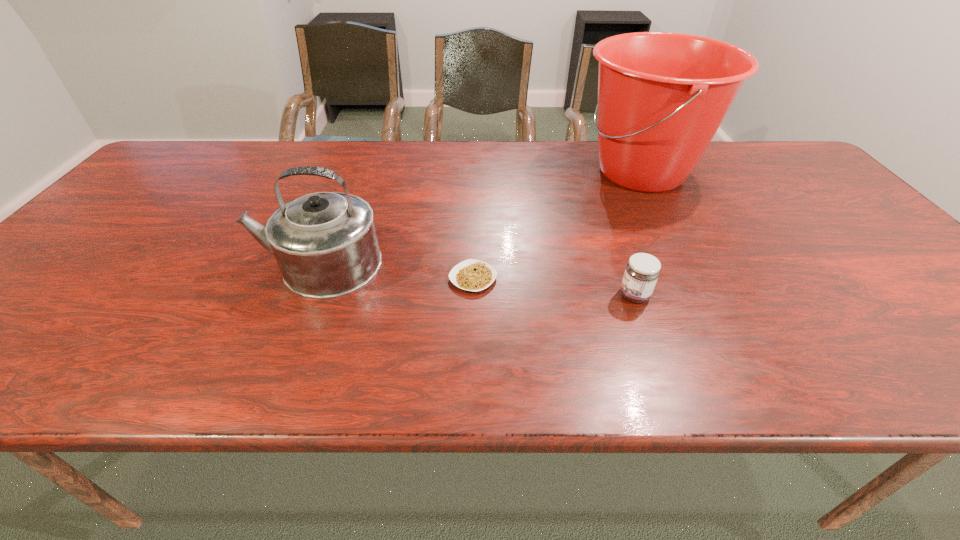
You are a GUI agent. You are given a task and a screenshot of the screen. Output one action in this format:
    pyautogui.click(x=<x>, y=<y>)
    Task: Click on the vacant space at the left edge of the desktop
    
    Given the screenshot: What is the action you would take?
    pyautogui.click(x=31, y=327)

In order to click on vacant space at the right edge of the desktop in this screenshot , I will do `click(785, 181)`.

Find the location of a particular element. Image resolution: width=960 pixels, height=540 pixels. vacant space at the far right corner is located at coordinates (754, 140).

Find the location of `vacant area at the near right corner`. vacant area at the near right corner is located at coordinates (936, 369).

This screenshot has width=960, height=540. In order to click on unoccupied area between the bucket and the legume in this screenshot , I will do `click(557, 225)`.

Where is `free space between the shortest object and the jam`? The height and width of the screenshot is (540, 960). free space between the shortest object and the jam is located at coordinates (554, 287).

Where is `free space between the bucket and the leftmost object`? This screenshot has width=960, height=540. free space between the bucket and the leftmost object is located at coordinates (479, 218).

The image size is (960, 540). Find the location of `free space between the bucket and the jam`. free space between the bucket and the jam is located at coordinates (637, 234).

Locate an element on the screen. free area in between the shortest object and the jam is located at coordinates (554, 287).

Locate an element on the screen. This screenshot has width=960, height=540. free space between the bucket and the legume is located at coordinates (557, 225).